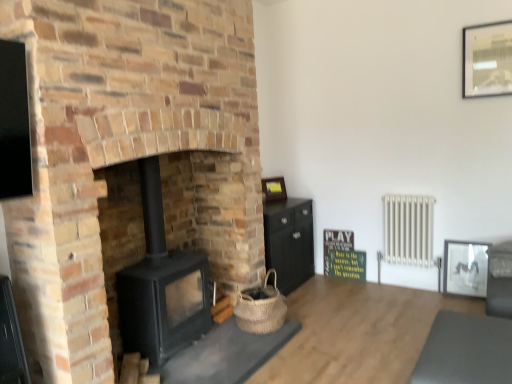
What do you see at coordinates (274, 189) in the screenshot? The height and width of the screenshot is (384, 512). I see `matte gold picture frame at center, which is counted as the 2th picture frame, starting from the bottom` at bounding box center [274, 189].

Where is `matte gold picture frame at center, which is counted as the 2th picture frame, starting from the bottom`? matte gold picture frame at center, which is counted as the 2th picture frame, starting from the bottom is located at coordinates (274, 189).

Find the location of `smooth gray mat at lower right`. smooth gray mat at lower right is located at coordinates (466, 350).

The height and width of the screenshot is (384, 512). In order to click on green matte signboard at center in this screenshot , I will do `click(343, 255)`.

Find the location of a particular element. The image size is (512, 384). matte gold picture frame at center, the third picture frame from the front is located at coordinates (274, 189).

Is metallic silver picture frame at upper right, which appears as the third picture frame when viewed from the back, next to woven natural basket at lower center?

They are not placed beside each other.

Considering the relative sizes of metallic silver picture frame at upper right, which ranks as the first picture frame in top-to-bottom order, and woven natural basket at lower center in the image provided, is metallic silver picture frame at upper right, which ranks as the first picture frame in top-to-bottom order, shorter than woven natural basket at lower center?

Incorrect, the height of metallic silver picture frame at upper right, which ranks as the first picture frame in top-to-bottom order, does not fall short of that of woven natural basket at lower center.

From the image's perspective, between metallic silver picture frame at upper right, the 3th picture frame from the left, and woven natural basket at lower center, who is located below?

woven natural basket at lower center, from the image's perspective.

Which object is more forward, metallic silver picture frame at upper right, acting as the first picture frame starting from the right, or woven natural basket at lower center?

woven natural basket at lower center is more forward.

Which of these two, woven natural basket at lower center or metallic silver picture frame at upper right, acting as the first picture frame starting from the right, stands shorter?

With less height is woven natural basket at lower center.

Is woven natural basket at lower center outside of metallic silver picture frame at upper right, which ranks as the first picture frame in top-to-bottom order?

Yes, woven natural basket at lower center is not within metallic silver picture frame at upper right, which ranks as the first picture frame in top-to-bottom order.

Is woven natural basket at lower center to the left of metallic silver picture frame at upper right, marked as the first picture frame in a front-to-back arrangement, from the viewer's perspective?

Indeed, woven natural basket at lower center is positioned on the left side of metallic silver picture frame at upper right, marked as the first picture frame in a front-to-back arrangement.

Is point (256, 302) less distant than point (473, 67)?

Yes, point (256, 302) is in front of point (473, 67).

From a real-world perspective, between black matte wood burning stove at center-left and matte gold picture frame at center, which appears as the third picture frame when viewed from the right, who is vertically higher?

From a 3D spatial view, matte gold picture frame at center, which appears as the third picture frame when viewed from the right, is above.

Is black matte wood burning stove at center-left positioned with its back to matte gold picture frame at center, which is counted as the first picture frame, starting from the left?

No, black matte wood burning stove at center-left's orientation is not away from matte gold picture frame at center, which is counted as the first picture frame, starting from the left.

Can we say black matte wood burning stove at center-left lies outside matte gold picture frame at center, which is counted as the first picture frame, starting from the left?

Yes.

From the image's perspective, who appears lower, black matte wood burning stove at center-left or matte gold picture frame at center, which is the second picture frame from top to bottom?

black matte wood burning stove at center-left.

Is green matte signboard at center far from matte gold picture frame at center, the third picture frame from the front?

No, green matte signboard at center is not far from matte gold picture frame at center, the third picture frame from the front.

From the image's perspective, who appears lower, green matte signboard at center or matte gold picture frame at center, the third picture frame from the front?

green matte signboard at center.

Between green matte signboard at center and matte gold picture frame at center, which is the second picture frame from top to bottom, which one appears on the right side from the viewer's perspective?

Positioned to the right is green matte signboard at center.

Could you tell me if green matte signboard at center is facing matte gold picture frame at center, which is counted as the first picture frame, starting from the left?

No, green matte signboard at center is not facing towards matte gold picture frame at center, which is counted as the first picture frame, starting from the left.

From the image's perspective, between black matte wood burning stove at center-left and green matte signboard at center, who is located below?

green matte signboard at center is shown below in the image.

In the scene shown: Can you confirm if black matte wood burning stove at center-left is positioned to the left of green matte signboard at center?

Yes, black matte wood burning stove at center-left is to the left of green matte signboard at center.

Where is `bulletin board on the right of the black matte wood burning stove at center-left`? bulletin board on the right of the black matte wood burning stove at center-left is located at coordinates (343, 255).

Which of these two, black matte wood burning stove at center-left or green matte signboard at center, is thinner?

green matte signboard at center is thinner.

Which is more to the right, smooth gray mat at lower right or woven natural basket at lower center?

Positioned to the right is smooth gray mat at lower right.

Relative to woven natural basket at lower center, is smooth gray mat at lower right in front or behind?

Visually, smooth gray mat at lower right is located in front of woven natural basket at lower center.

Is smooth gray mat at lower right far away from woven natural basket at lower center?

smooth gray mat at lower right is positioned a significant distance from woven natural basket at lower center.

From the picture: How many degrees apart are the facing directions of smooth gray mat at lower right and woven natural basket at lower center?

There is a 178-degree angle between the facing directions of smooth gray mat at lower right and woven natural basket at lower center.

Can we say metallic silver picture frame at upper right, the 3th picture frame from the left, lies outside matte black picture frame at right, the second picture frame positioned from the right?

That's correct, metallic silver picture frame at upper right, the 3th picture frame from the left, is outside of matte black picture frame at right, the second picture frame positioned from the right.

Is metallic silver picture frame at upper right, acting as the first picture frame starting from the right, positioned far away from matte black picture frame at right, acting as the 2th picture frame starting from the left?

Yes.

Who is more distant, metallic silver picture frame at upper right, marked as the first picture frame in a front-to-back arrangement, or matte black picture frame at right, placed as the second picture frame when sorted from front to back?

Positioned behind is matte black picture frame at right, placed as the second picture frame when sorted from front to back.

Does metallic silver picture frame at upper right, which appears as the third picture frame when viewed from the back, turn towards matte black picture frame at right, the 1th picture frame positioned from the bottom?

No.

At what (x,y) coordinates should I click in order to perform the action: click on basket in front of the metallic silver picture frame at upper right, marked as the first picture frame in a front-to-back arrangement. Please return your answer as a coordinate pair (x, y). Image resolution: width=512 pixels, height=384 pixels. Looking at the image, I should click on (261, 309).

I want to click on the 1st picture frame behind the woven natural basket at lower center, so click(x=487, y=60).

When comparing their distances from black matte wood burning stove at center-left, does matte black wood stove at center or matte gold picture frame at center, the third picture frame from the front, seem closer?

matte black wood stove at center is positioned closer to the anchor black matte wood burning stove at center-left.

From the image, which object appears to be farther from woven natural basket at lower center, smooth gray mat at lower right or matte black wood stove at center?

smooth gray mat at lower right lies further to woven natural basket at lower center than the other object.

Looking at the image, which one is located closer to matte black wood stove at center, matte gold picture frame at center, which is counted as the 2th picture frame, starting from the bottom, or green matte signboard at center?

The object closer to matte black wood stove at center is matte gold picture frame at center, which is counted as the 2th picture frame, starting from the bottom.

Which object lies nearer to the anchor point woven natural basket at lower center, green matte signboard at center or metallic silver picture frame at upper right, the 3th picture frame from the left?

Based on the image, green matte signboard at center appears to be nearer to woven natural basket at lower center.

Looking at the image, which one is located further to white metallic radiator at right, black matte wood burning stove at center-left or matte gold picture frame at center, which is counted as the first picture frame, starting from the left?

The object further to white metallic radiator at right is black matte wood burning stove at center-left.

When comparing their distances from smooth gray mat at lower right, does black matte wood burning stove at center-left or metallic silver picture frame at upper right, which ranks as the first picture frame in top-to-bottom order, seem closer?

black matte wood burning stove at center-left lies closer to smooth gray mat at lower right than the other object.

Considering their positions, is matte gold picture frame at center, which appears as the third picture frame when viewed from the right, positioned further to matte black picture frame at right, acting as the 2th picture frame starting from the left, than green matte signboard at center?

matte gold picture frame at center, which appears as the third picture frame when viewed from the right, lies further to matte black picture frame at right, acting as the 2th picture frame starting from the left, than the other object.

Based on their spatial positions, is matte black wood stove at center or metallic silver picture frame at upper right, which appears as the third picture frame when viewed from the back, closer to smooth gray mat at lower right?

The object closer to smooth gray mat at lower right is matte black wood stove at center.

This screenshot has width=512, height=384. Find the location of `basket located between smooth gray mat at lower right and matte gold picture frame at center, marked as the first picture frame in a back-to-front arrangement, in the depth direction`. basket located between smooth gray mat at lower right and matte gold picture frame at center, marked as the first picture frame in a back-to-front arrangement, in the depth direction is located at coordinates (261, 309).

The width and height of the screenshot is (512, 384). Find the location of `basket between smooth gray mat at lower right and white metallic radiator at right from front to back`. basket between smooth gray mat at lower right and white metallic radiator at right from front to back is located at coordinates (261, 309).

Where is `bulletin board between black matte wood burning stove at center-left and metallic silver picture frame at upper right, marked as the first picture frame in a front-to-back arrangement, in the horizontal direction`? The width and height of the screenshot is (512, 384). bulletin board between black matte wood burning stove at center-left and metallic silver picture frame at upper right, marked as the first picture frame in a front-to-back arrangement, in the horizontal direction is located at coordinates (343, 255).

At what (x,y) coordinates should I click in order to perform the action: click on bulletin board between black matte wood burning stove at center-left and matte gold picture frame at center, which appears as the third picture frame when viewed from the right, in the front-back direction. Please return your answer as a coordinate pair (x, y). This screenshot has width=512, height=384. Looking at the image, I should click on (343, 255).